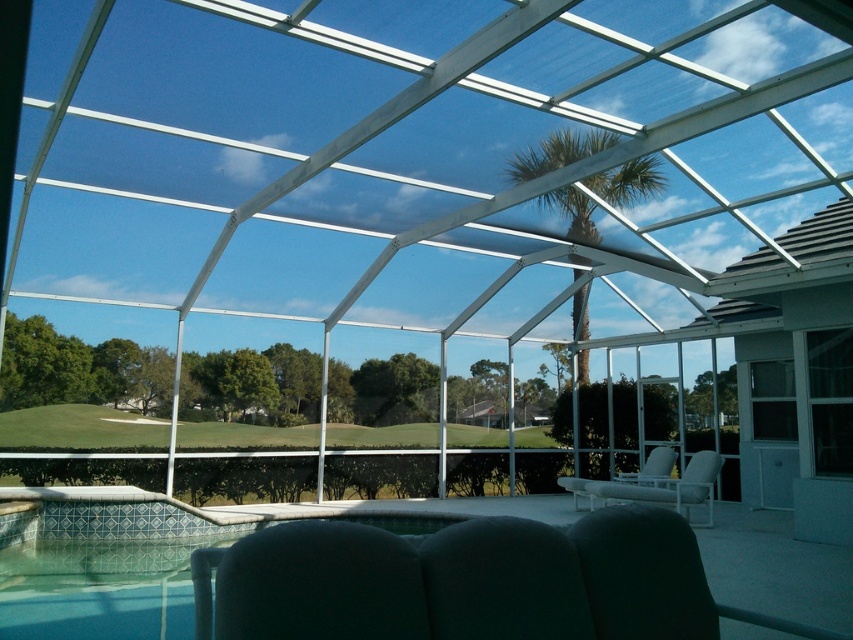
You are standing at the origin point in the glass enclosure. Which object is located at point (311,584)?

The black leather chair at lower center is located at point (311,584).

You are planning to host a small gathering and need to seat guests comfortably. You have two chairs available in the enclosure near the pool edge. The black leather chair at lower center and the white plastic chair at lower right. Which chair has a wider seating area to accommodate larger guests?

The white plastic chair at lower right has a wider seating area since its width is greater than the black leather chair at lower center.

You are planning to host a small gathering in the sunroom and want to seat two guests comfortably. Given the space available, which chair between the dark gray fabric chair at lower center and the white plastic chair at center would you choose to accommodate a larger guest?

The white plastic chair at center is larger in size, making it a better choice to accommodate a larger guest.